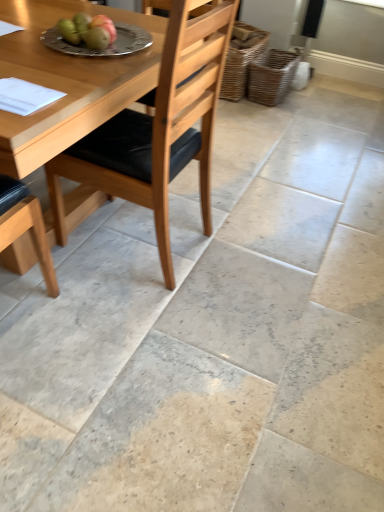
At what (x,y) coordinates should I click in order to perform the action: click on vacant area that is situated to the right of natural wood chair at center. Please return your answer as a coordinate pair (x, y). The width and height of the screenshot is (384, 512). Looking at the image, I should click on (239, 257).